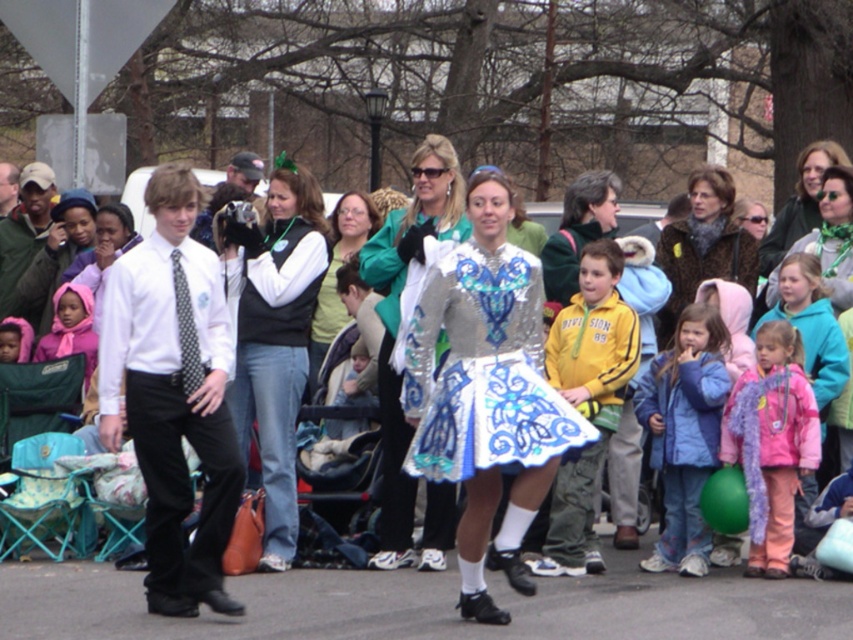
You are a photographer at the parade and want to capture a photo that includes both the pink fleece jacket at lower right and the polka dot tie at center. Based on their positions, which object should you focus on first to ensure both are in the frame?

The pink fleece jacket at lower right is located below the polka dot tie at center, so you should focus on the polka dot tie at center first to ensure both are in the frame.

You are a photographer trying to capture the entire scene of the parade. You notice the brown fuzzy coat at center and the matte pink scarf at lower left. Based on their positions and sizes, which object should you prioritize framing first to ensure both are visible in the photo?

The brown fuzzy coat at center might be wider than matte pink scarf at lower left, so you should prioritize framing the brown fuzzy coat at center first to ensure both are visible in the photo.